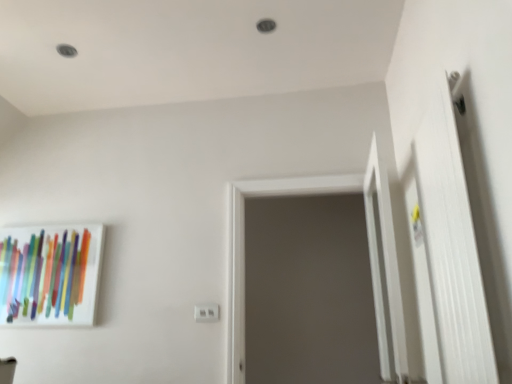
The height and width of the screenshot is (384, 512). Describe the element at coordinates (244, 254) in the screenshot. I see `gray matte screen door at center` at that location.

At what (x,y) coordinates should I click in order to perform the action: click on white plastic electric outlet at center. Please return your answer as a coordinate pair (x, y). The width and height of the screenshot is (512, 384). Looking at the image, I should click on (206, 312).

Which object is thinner, white matte door at right or gray matte screen door at center?

white matte door at right is thinner.

Is white matte door at right shorter than gray matte screen door at center?

Indeed, white matte door at right has a lesser height compared to gray matte screen door at center.

In the image, is white matte door at right positioned in front of or behind gray matte screen door at center?

Clearly, white matte door at right is in front of gray matte screen door at center.

Is point (454, 293) more distant than point (208, 314)?

That is False.

Which is more to the left, white matte door at right or white plastic electric outlet at center?

white plastic electric outlet at center is more to the left.

From a real-world perspective, is white matte door at right located beneath white plastic electric outlet at center?

No, from a real-world perspective, white matte door at right is not below white plastic electric outlet at center.

Can you tell me how much matte glass picture frame at left and gray matte screen door at center differ in facing direction?

0.425 degrees.

Is point (48, 248) farther from camera compared to point (241, 262)?

That is True.

Is matte glass picture frame at left oriented away from gray matte screen door at center?

No, matte glass picture frame at left is not facing the opposite direction of gray matte screen door at center.

Measure the distance between white plastic electric outlet at center and matte glass picture frame at left.

A distance of 98.63 centimeters exists between white plastic electric outlet at center and matte glass picture frame at left.

Based on their positions, is white plastic electric outlet at center located to the left or right of matte glass picture frame at left?

In the image, white plastic electric outlet at center appears on the right side of matte glass picture frame at left.

From the image's perspective, is white plastic electric outlet at center on matte glass picture frame at left?

Actually, white plastic electric outlet at center appears below matte glass picture frame at left in the image.

Can you tell me how much white plastic electric outlet at center and matte glass picture frame at left differ in facing direction?

0.855 degrees separate the facing orientations of white plastic electric outlet at center and matte glass picture frame at left.

From a real-world perspective, is gray matte screen door at center located beneath white plastic electric outlet at center?

No, from a real-world perspective, gray matte screen door at center is not beneath white plastic electric outlet at center.

Is gray matte screen door at center further to the viewer compared to white plastic electric outlet at center?

No, it is in front of white plastic electric outlet at center.

Would you say gray matte screen door at center contains white plastic electric outlet at center?

No, white plastic electric outlet at center is not surrounded by gray matte screen door at center.

Which object is closer to the camera taking this photo, gray matte screen door at center or white matte door at right?

white matte door at right is more forward.

Identify the location of door in front of the gray matte screen door at center. (447, 250).

Is gray matte screen door at center far from white matte door at right?

No, gray matte screen door at center is not far from white matte door at right.

From the image's perspective, who appears lower, white plastic electric outlet at center or gray matte screen door at center?

white plastic electric outlet at center appears lower in the image.

Are white plastic electric outlet at center and gray matte screen door at center far apart?

white plastic electric outlet at center is near gray matte screen door at center, not far away.

Between white plastic electric outlet at center and gray matte screen door at center, which one has larger size?

gray matte screen door at center.

Locate an element on the screen. The image size is (512, 384). door on the right of gray matte screen door at center is located at coordinates (447, 250).

Identify the location of electric outlet that appears behind the white matte door at right. (206, 312).

From the image, which object appears to be nearer to gray matte screen door at center, white plastic electric outlet at center or white matte door at right?

white matte door at right.

When comparing their distances from matte glass picture frame at left, does gray matte screen door at center or white matte door at right seem closer?

Based on the image, gray matte screen door at center appears to be nearer to matte glass picture frame at left.

From the image, which object appears to be nearer to white plastic electric outlet at center, matte glass picture frame at left or white matte door at right?

matte glass picture frame at left lies closer to white plastic electric outlet at center than the other object.

Looking at the image, which one is located closer to matte glass picture frame at left, gray matte screen door at center or white plastic electric outlet at center?

Based on the image, white plastic electric outlet at center appears to be nearer to matte glass picture frame at left.

From the image, which object appears to be farther from matte glass picture frame at left, white plastic electric outlet at center or gray matte screen door at center?

gray matte screen door at center is further to matte glass picture frame at left.

Estimate the real-world distances between objects in this image. Which object is further from gray matte screen door at center, white matte door at right or matte glass picture frame at left?

matte glass picture frame at left is positioned further to the anchor gray matte screen door at center.

Which object lies nearer to the anchor point gray matte screen door at center, matte glass picture frame at left or white plastic electric outlet at center?

white plastic electric outlet at center is positioned closer to the anchor gray matte screen door at center.

Which object lies nearer to the anchor point white plastic electric outlet at center, gray matte screen door at center or matte glass picture frame at left?

Based on the image, gray matte screen door at center appears to be nearer to white plastic electric outlet at center.

I want to click on electric outlet between matte glass picture frame at left and white matte door at right from left to right, so click(x=206, y=312).

You are a GUI agent. You are given a task and a screenshot of the screen. Output one action in this format:
    pyautogui.click(x=<x>, y=<y>)
    Task: Click on the screen door positioned between white matte door at right and white plastic electric outlet at center from near to far
    The height and width of the screenshot is (384, 512).
    Given the screenshot: What is the action you would take?
    point(244,254)

Identify the location of electric outlet between matte glass picture frame at left and gray matte screen door at center in the horizontal direction. The width and height of the screenshot is (512, 384). (206, 312).

Identify the location of screen door between matte glass picture frame at left and white matte door at right. (244, 254).